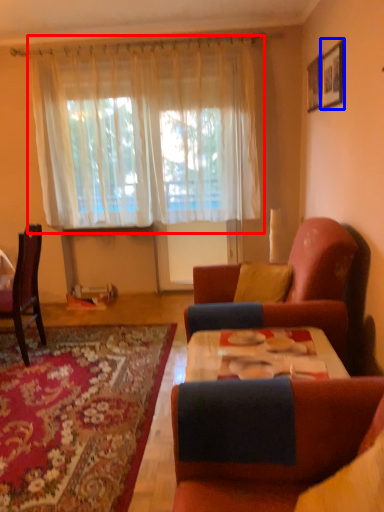
Question: Which point is further to the camera, curtain (highlighted by a red box) or picture frame (highlighted by a blue box)?

Choices:
 (A) curtain
 (B) picture frame

Answer: (A)